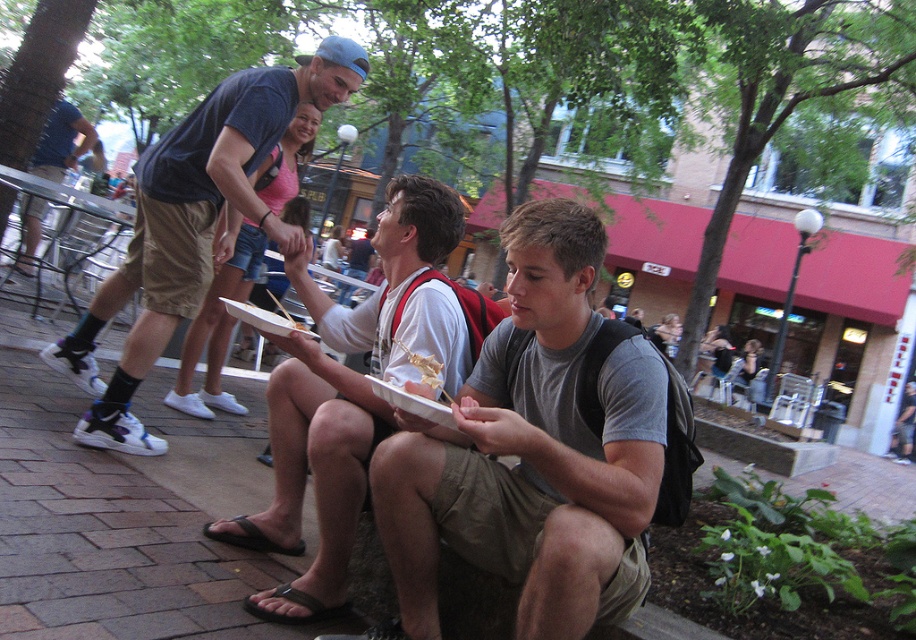
Is gray cotton t-shirt at center shorter than matte blue shirt at center?

Yes.

Does point (640, 381) come closer to viewer compared to point (49, 136)?

Yes, point (640, 381) is in front of point (49, 136).

Between point (533, 365) and point (60, 166), which one is positioned in front?

Positioned in front is point (533, 365).

The height and width of the screenshot is (640, 916). Find the location of `gray cotton t-shirt at center`. gray cotton t-shirt at center is located at coordinates (533, 451).

Between point (546, 464) and point (188, 269), which one is positioned behind?

Point (188, 269)

Image resolution: width=916 pixels, height=640 pixels. Find the location of `gray cotton t-shirt at center`. gray cotton t-shirt at center is located at coordinates (533, 451).

Who is positioned more to the left, white matte shirt at center or matte blue t-shirt at center?

From the viewer's perspective, matte blue t-shirt at center appears more on the left side.

At what (x,y) coordinates should I click in order to perform the action: click on white matte shirt at center. Please return your answer as a coordinate pair (x, y). The width and height of the screenshot is (916, 640). Looking at the image, I should click on 312,477.